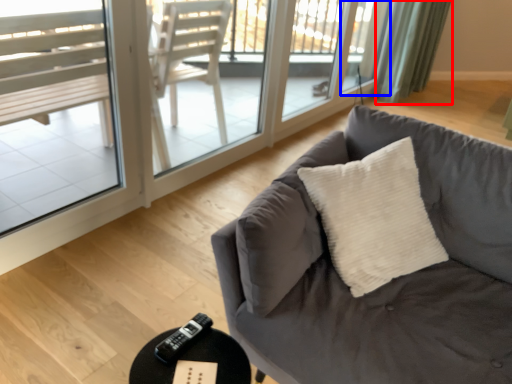
Question: Which point is further to the camera, curtain (highlighted by a red box) or window (highlighted by a blue box)?

Choices:
 (A) curtain
 (B) window

Answer: (A)